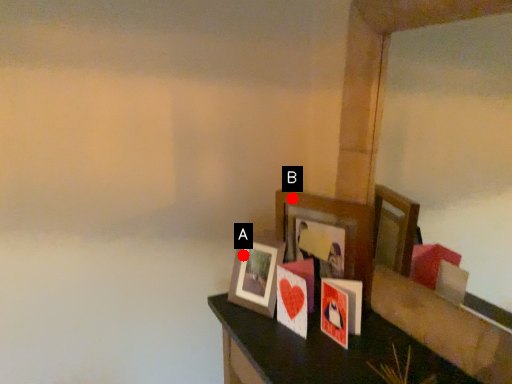
Question: Two points are circled on the image, labeled by A and B beside each circle. Among these points, which one is farthest from the camera?

Choices:
 (A) A is further
 (B) B is further

Answer: (A)